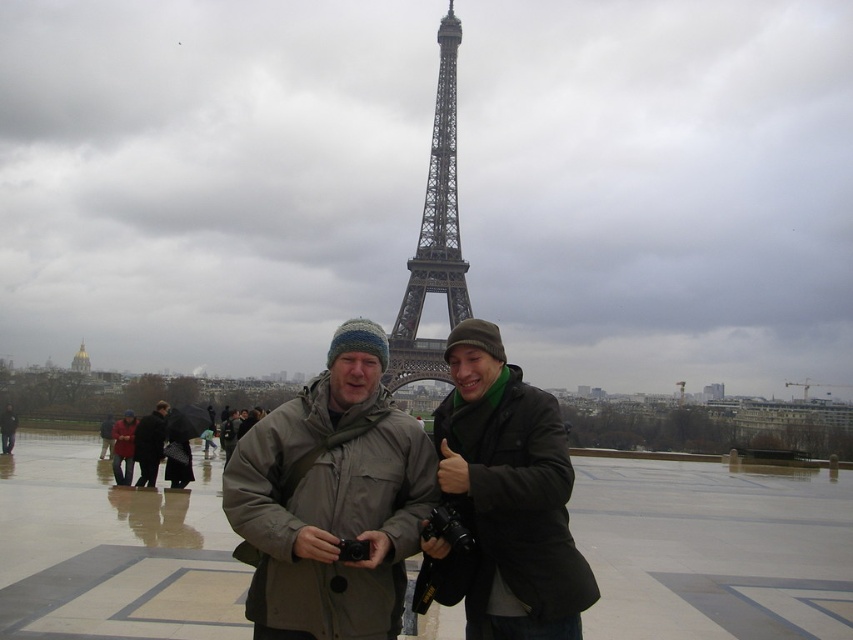
Question: Is dark gray knit hat at center thinner than red wool coat at center?

Choices:
 (A) yes
 (B) no

Answer: (B)

Question: Which point is farther from the camera taking this photo?

Choices:
 (A) (454, 330)
 (B) (439, 68)
 (C) (129, 481)
 (D) (138, 442)

Answer: (B)

Question: Can you confirm if metallic gray eiffel tower at center is wider than dark gray knit hat at center?

Choices:
 (A) no
 (B) yes

Answer: (B)

Question: Is dark green matte jacket at center to the left of red wool coat at center from the viewer's perspective?

Choices:
 (A) no
 (B) yes

Answer: (A)

Question: Which object appears farthest from the camera in this image?

Choices:
 (A) red wool coat at center
 (B) knit cap at center
 (C) dark brown leather coat at lower left
 (D) dark green matte jacket at center

Answer: (A)

Question: Which of these objects is positioned farthest from the red wool coat at center?

Choices:
 (A) metallic gray eiffel tower at center
 (B) dark brown leather coat at lower left
 (C) dark gray knit hat at center

Answer: (A)